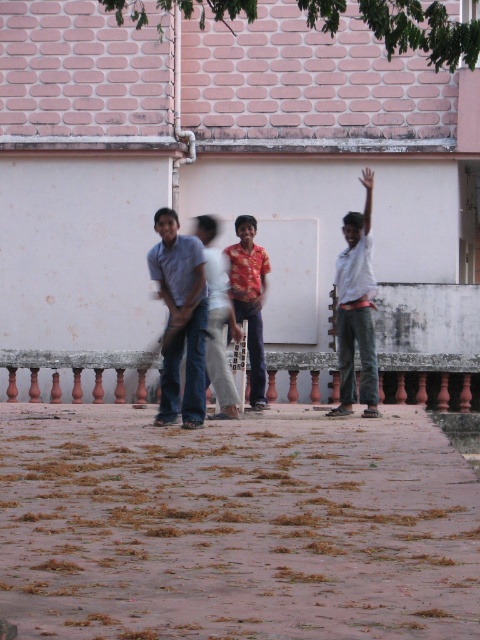
From the picture: Is white cotton shirt at right taller than shiny red shirt at center?

Yes.

Is point (360, 388) less distant than point (255, 333)?

Yes, point (360, 388) is closer to viewer.

Identify the location of white cotton shirt at right. The height and width of the screenshot is (640, 480). (357, 308).

Between matte blue shirt at center and shiny red shirt at center, which one has more height?

With more height is shiny red shirt at center.

This screenshot has height=640, width=480. I want to click on matte blue shirt at center, so click(x=180, y=317).

Can you confirm if brown dirt at lower center is shorter than matte blue shirt at center?

Indeed, brown dirt at lower center has a lesser height compared to matte blue shirt at center.

Image resolution: width=480 pixels, height=640 pixels. What do you see at coordinates (235, 525) in the screenshot?
I see `brown dirt at lower center` at bounding box center [235, 525].

What do you see at coordinates (235, 525) in the screenshot?
I see `brown dirt at lower center` at bounding box center [235, 525].

In order to click on brown dirt at lower center in this screenshot , I will do `click(235, 525)`.